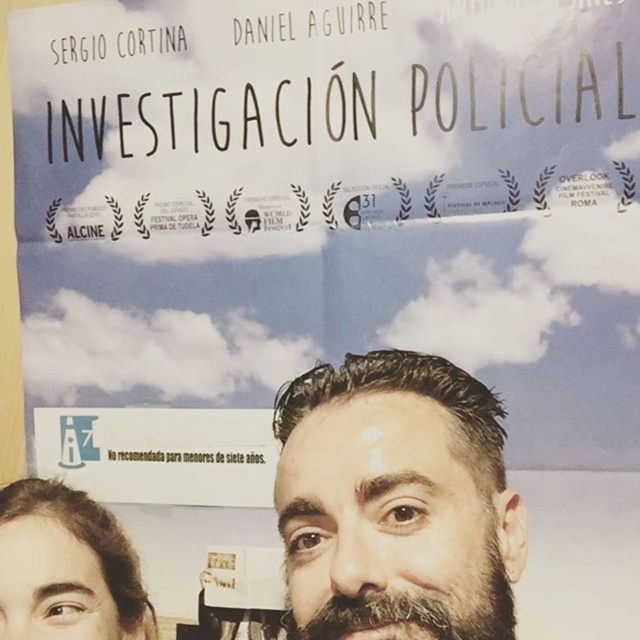
You are holding a camera to take a photo of the movie poster. The camera is currently positioned at a point that is 22.38 inches away from the point at coordinate point (x=323, y=525). Is the camera close enough to capture the entire movie poster in the frame?

The camera is 22.38 inches away from the point at coordinate point (x=323, y=525). Since the movie poster is part of the scene and the distance is specified, the camera is positioned at that distance, but without knowing the poster size or camera lens details, it is impossible to determine if the entire poster fits in the frame.